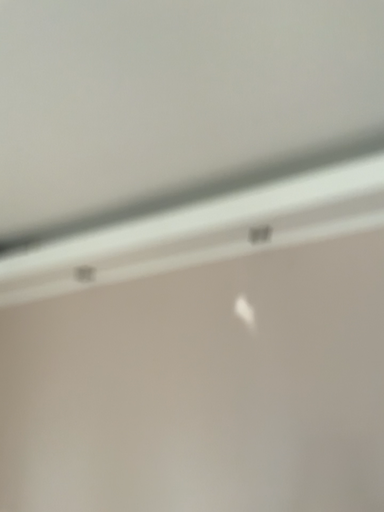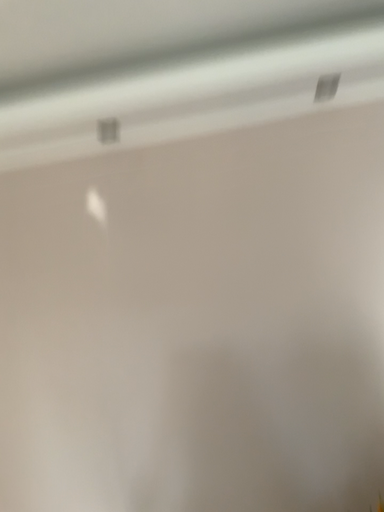
Question: Which way did the camera rotate in the video?

Choices:
 (A) rotated right
 (B) rotated left

Answer: (A)